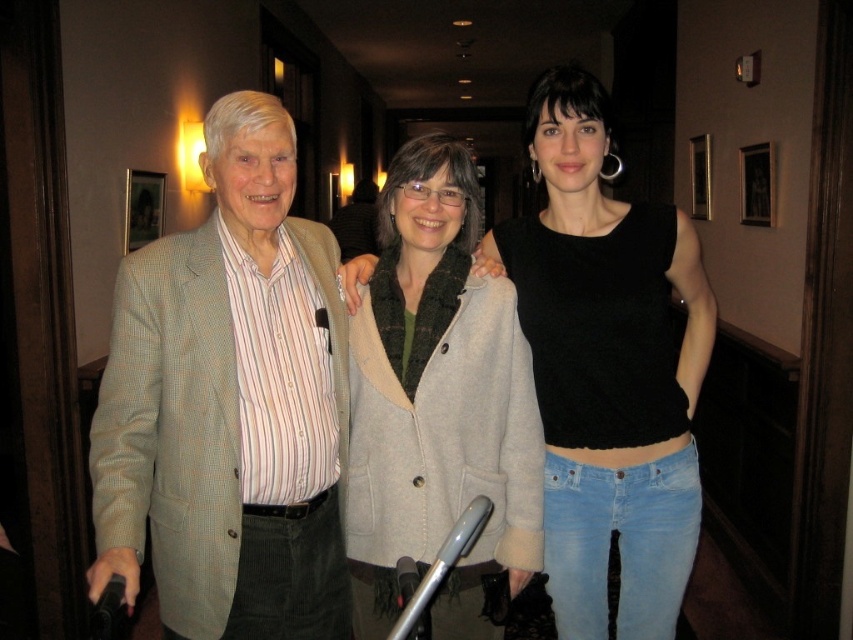
In the scene shown: You are a fashion designer observing the scene. You need to decide which jacket to recommend for a client who prefers a more compact design. Which one between the light brown wool jacket at left and the light gray wool coat at center would you suggest?

The light gray wool coat at center is smaller in size than the light brown wool jacket at left, so I would recommend the light gray wool coat at center for a more compact design.

You are a photographer trying to capture the black matte tank top at center in the image. The camera you are using has a focus point at coordinate point (606, 369). Will this point help you focus on the black matte tank top at center?

Yes, the point (606, 369) is on the black matte tank top at center, so using this focus point will help you focus on it.